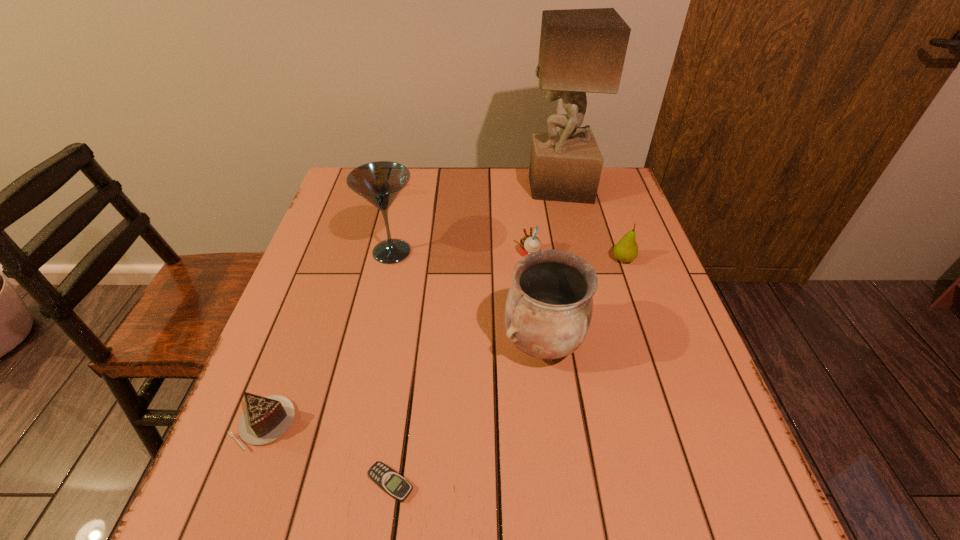
Where is `vacant area situated 0.260m on the left of the beeper`? vacant area situated 0.260m on the left of the beeper is located at coordinates (210, 483).

This screenshot has height=540, width=960. Identify the location of object that is at the far edge. (581, 50).

Locate an element on the screen. object located at the near edge is located at coordinates (394, 484).

Where is `martini present at the left edge`? Image resolution: width=960 pixels, height=540 pixels. martini present at the left edge is located at coordinates (380, 183).

What are the coordinates of `chocolate cake that is at the left edge` in the screenshot? It's located at (266, 419).

Identify the location of sculpture that is at the right edge. The image size is (960, 540). (581, 50).

Find the location of a particular element. pear that is at the right edge is located at coordinates (626, 250).

The width and height of the screenshot is (960, 540). I want to click on object that is positioned at the far right corner, so click(581, 50).

At what (x,y) coordinates should I click in order to perform the action: click on free space at the far edge. Please return your answer as a coordinate pair (x, y). Looking at the image, I should click on (468, 172).

Locate an element on the screen. vacant area at the near edge is located at coordinates (424, 521).